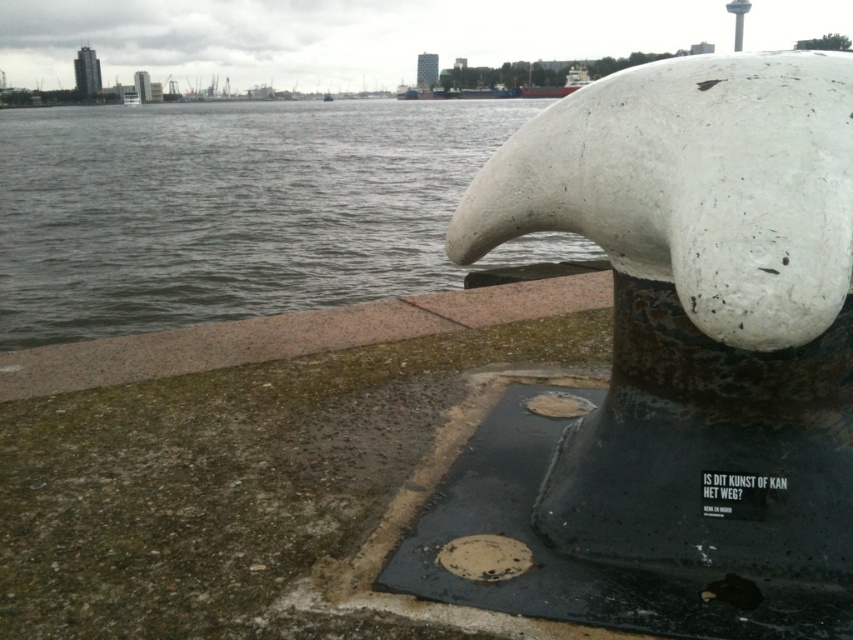
Is point (688, 198) positioned in front of point (276, 262)?

That is True.

Where is `white matte sculpture at center`? white matte sculpture at center is located at coordinates (700, 307).